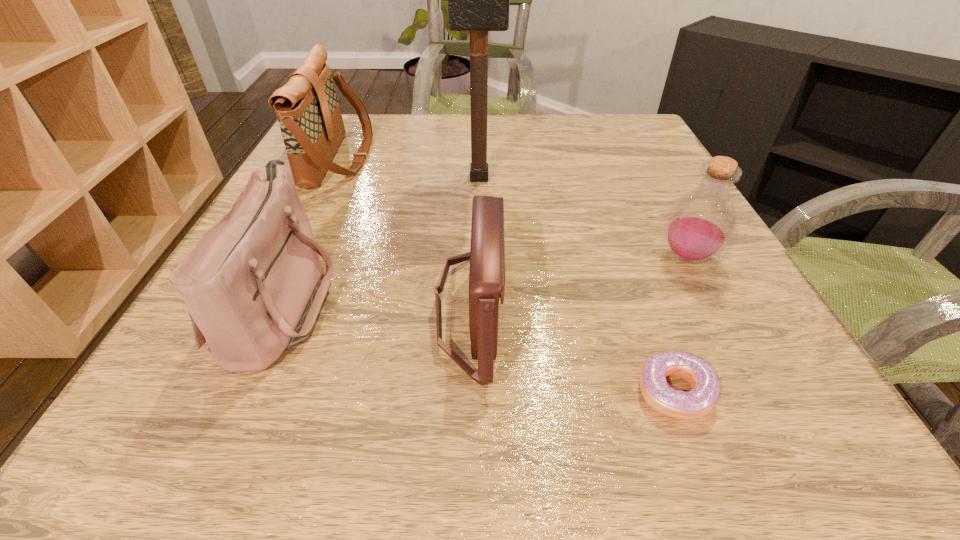
Where is `vacant point that satisfies the following two spatial constraints: 1. on the front-facing side of the farthest shoulder bag; 2. on the back side of the mallet`? The width and height of the screenshot is (960, 540). vacant point that satisfies the following two spatial constraints: 1. on the front-facing side of the farthest shoulder bag; 2. on the back side of the mallet is located at coordinates (330, 178).

Image resolution: width=960 pixels, height=540 pixels. Identify the location of free space that satisfies the following two spatial constraints: 1. on the front pocket of the second tallest shoulder bag; 2. on the back side of the doughnut. (243, 392).

Locate an element on the screen. The height and width of the screenshot is (540, 960). free space in the image that satisfies the following two spatial constraints: 1. on the front flap of the shortest shoulder bag; 2. on the right side of the doughnut is located at coordinates click(x=468, y=392).

Where is `free space in the image that satisfies the following two spatial constraints: 1. on the front-facing side of the bottle; 2. on the right side of the tallest shoulder bag`? free space in the image that satisfies the following two spatial constraints: 1. on the front-facing side of the bottle; 2. on the right side of the tallest shoulder bag is located at coordinates (293, 256).

Find the location of a particular element. free region that satisfies the following two spatial constraints: 1. on the front-facing side of the tallest shoulder bag; 2. on the back side of the rightmost object is located at coordinates (293, 256).

Find the location of a particular element. free space that satisfies the following two spatial constraints: 1. on the front-facing side of the tallest object; 2. on the right side of the farthest shoulder bag is located at coordinates 330,178.

This screenshot has width=960, height=540. Find the location of `blank space that satisfies the following two spatial constraints: 1. on the front-facing side of the farthest shoulder bag; 2. on the left side of the doughnut`. blank space that satisfies the following two spatial constraints: 1. on the front-facing side of the farthest shoulder bag; 2. on the left side of the doughnut is located at coordinates (228, 392).

You are a GUI agent. You are given a task and a screenshot of the screen. Output one action in this format:
    pyautogui.click(x=<x>, y=<y>)
    Task: Click on the vacant space that satisfies the following two spatial constraints: 1. on the front side of the rightmost object; 2. on the front pocket of the second shortest shoulder bag
    This screenshot has height=540, width=960.
    Given the screenshot: What is the action you would take?
    pyautogui.click(x=710, y=302)